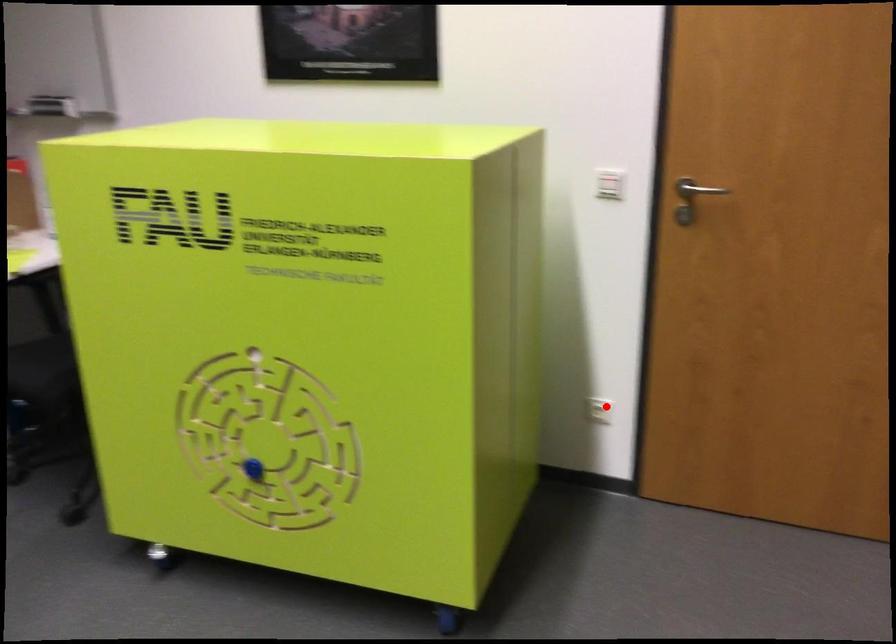
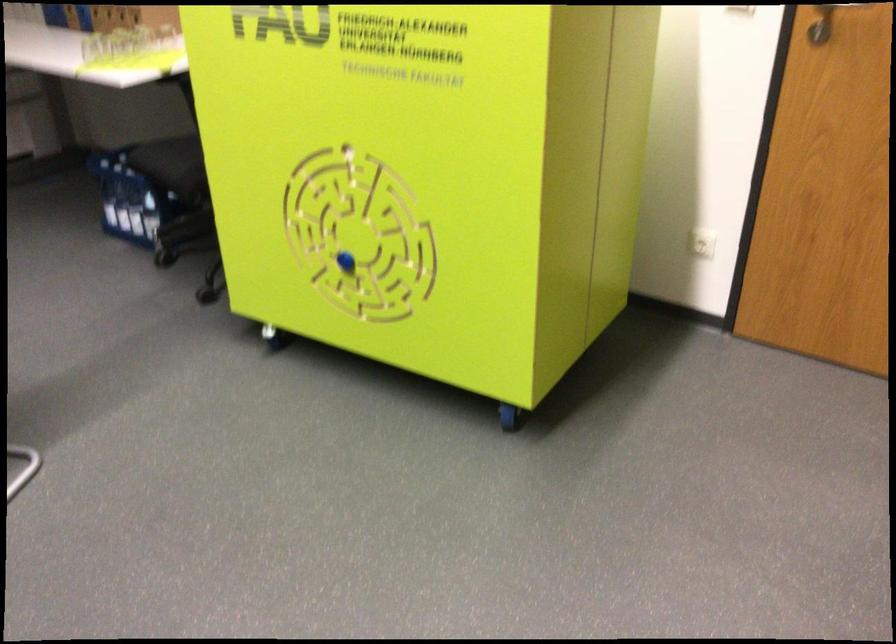
Question: I am providing you with two images of the same scene from different viewpoints. A red point is marked on the first image. Is the red point's position out of view in image 2?

Choices:
 (A) Yes
 (B) No

Answer: (B)